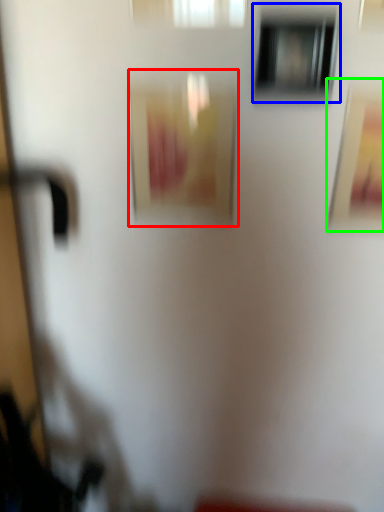
Question: Estimate the real-world distances between objects in this image. Which object is farther from picture frame (highlighted by a red box), window (highlighted by a blue box) or picture frame (highlighted by a green box)?

Choices:
 (A) window
 (B) picture frame

Answer: (B)